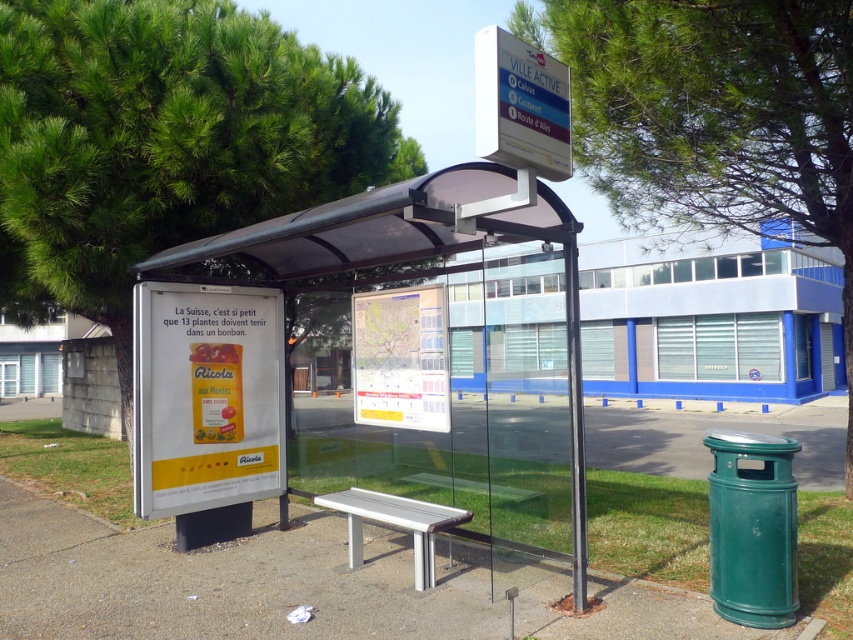
You are a bus passenger who wants to check the bus schedule displayed on the yellow paper sign at center. However, you are sitting on the silver metallic bench at center. Can you reach the sign to read it without getting up?

The yellow paper sign at center is narrower than the silver metallic bench at center, so if the bench is wide enough to allow you to reach across its width, you might be able to read the sign while sitting. However, this depends on your arm length and the exact dimensions of the bench and sign.

You are a person who wants to sit down at the bus stop. There are two benches available. The concrete bench at center and the white plastic bench at center. Which bench is closer to the advertisement for Ricola cough drops?

The concrete bench at center is closer to the advertisement for Ricola cough drops because it is located on the left side of the shelter where the ad is placed, while the white plastic bench at center is positioned further away from the ad.